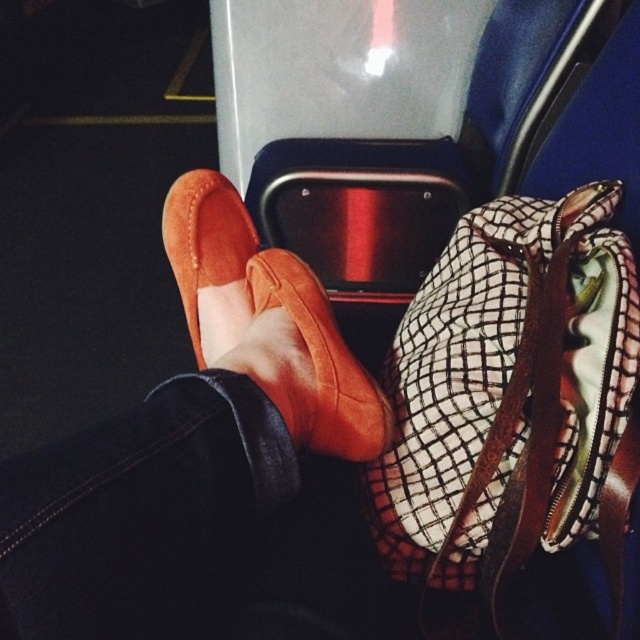
You are looking at the image of a person sitting in a vehicle. There are two points marked in the image. The first point is at coordinates point (449, 442) and the second is at point (193, 288). Which point is closer to you?

Point (449, 442) is closer to the viewer than point (193, 288).